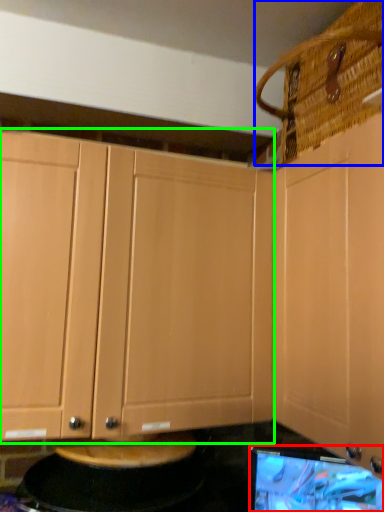
Question: Considering the real-world distances, which object is farthest from computer monitor (highlighted by a red box)? basket (highlighted by a blue box) or cabinetry (highlighted by a green box)?

Choices:
 (A) basket
 (B) cabinetry

Answer: (A)